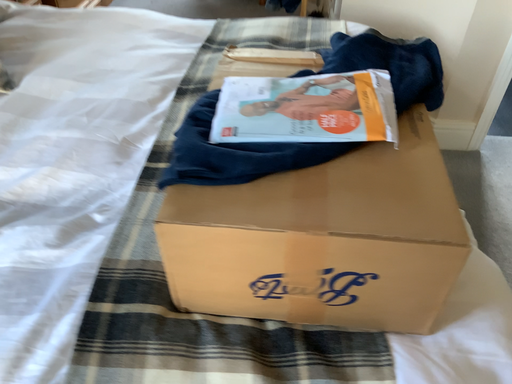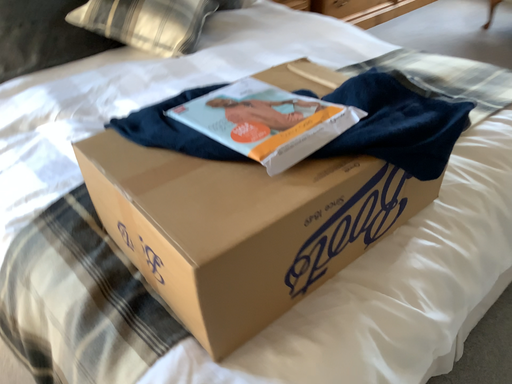
Question: Which way did the camera rotate in the video?

Choices:
 (A) rotated downward
 (B) rotated upward

Answer: (B)